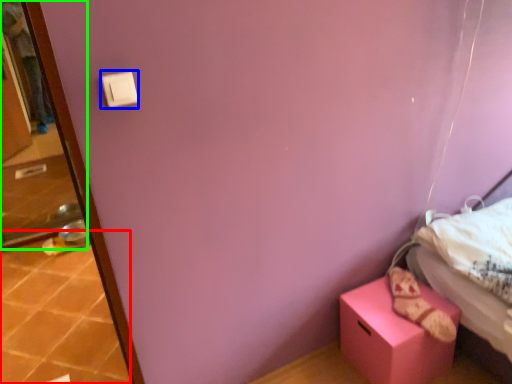
Question: Which object is positioned closest to tile (highlighted by a red box)? Select from light switch (highlighted by a blue box) and screen door (highlighted by a green box).

Choices:
 (A) light switch
 (B) screen door

Answer: (B)